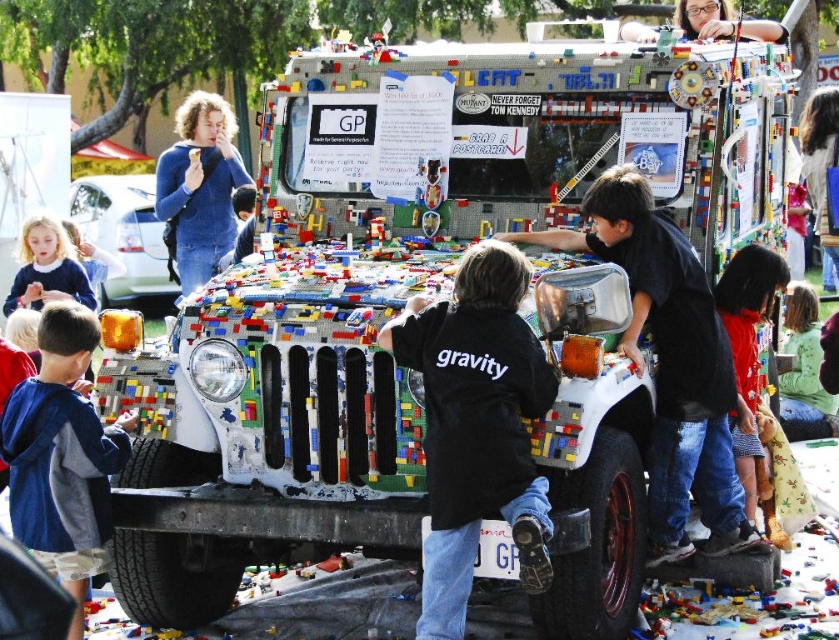
Question: Observing the image, what is the correct spatial positioning of blue-gray hoodie at lower left in reference to white plastic car at upper left?

Choices:
 (A) above
 (B) below

Answer: (B)

Question: From the image, what is the correct spatial relationship of black matte jacket at center in relation to black cotton shirt at center?

Choices:
 (A) below
 (B) above

Answer: (A)

Question: Which object is closer to the camera taking this photo?

Choices:
 (A) blue-gray hoodie at lower left
 (B) blue sweater at upper left
 (C) black cotton shirt at center

Answer: (A)

Question: Considering the real-world distances, which object is farthest from the blue-gray hoodie at lower left?

Choices:
 (A) blue sweater at upper left
 (B) black matte jacket at center

Answer: (A)

Question: Observing the image, what is the correct spatial positioning of green textured sweater at center in reference to matte black hair at upper center?

Choices:
 (A) below
 (B) above

Answer: (A)

Question: Which point is farther to the camera?

Choices:
 (A) (740, 401)
 (B) (621, 35)
 (C) (175, 218)

Answer: (C)